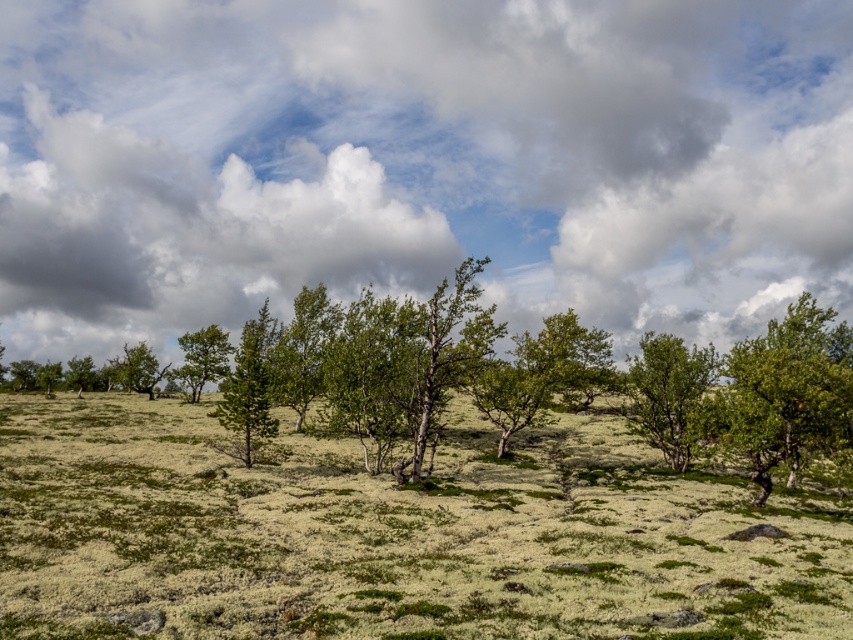
Does green matte tree at center appear on the right side of green leafy tree at center?

Indeed, green matte tree at center is positioned on the right side of green leafy tree at center.

Where is `green matte tree at center`? Image resolution: width=853 pixels, height=640 pixels. green matte tree at center is located at coordinates (670, 394).

The image size is (853, 640). Find the location of `cloudy sky at upper center`. cloudy sky at upper center is located at coordinates (419, 163).

Does cloudy sky at upper center appear over green leafy tree at right?

Indeed, cloudy sky at upper center is positioned over green leafy tree at right.

What do you see at coordinates (419, 163) in the screenshot?
I see `cloudy sky at upper center` at bounding box center [419, 163].

The height and width of the screenshot is (640, 853). In order to click on cloudy sky at upper center in this screenshot , I will do `click(419, 163)`.

What do you see at coordinates (419, 163) in the screenshot? Image resolution: width=853 pixels, height=640 pixels. I see `cloudy sky at upper center` at bounding box center [419, 163].

Is cloudy sky at upper center smaller than green leafy tree at center?

Incorrect, cloudy sky at upper center is not smaller in size than green leafy tree at center.

This screenshot has width=853, height=640. What do you see at coordinates (419, 163) in the screenshot? I see `cloudy sky at upper center` at bounding box center [419, 163].

The height and width of the screenshot is (640, 853). I want to click on cloudy sky at upper center, so click(419, 163).